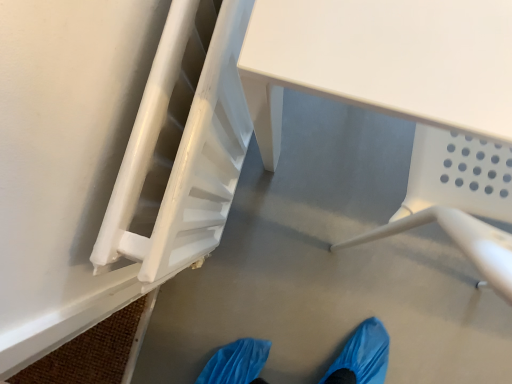
Describe the element at coordinates (123, 156) in the screenshot. The height and width of the screenshot is (384, 512). I see `white glossy stairs at center` at that location.

You are a GUI agent. You are given a task and a screenshot of the screen. Output one action in this format:
    pyautogui.click(x=<x>, y=<y>)
    Task: Click on the white glossy stairs at center
    This screenshot has width=512, height=384.
    Given the screenshot: What is the action you would take?
    [x=123, y=156]

This screenshot has width=512, height=384. Identify the location of white glossy stairs at center. (123, 156).